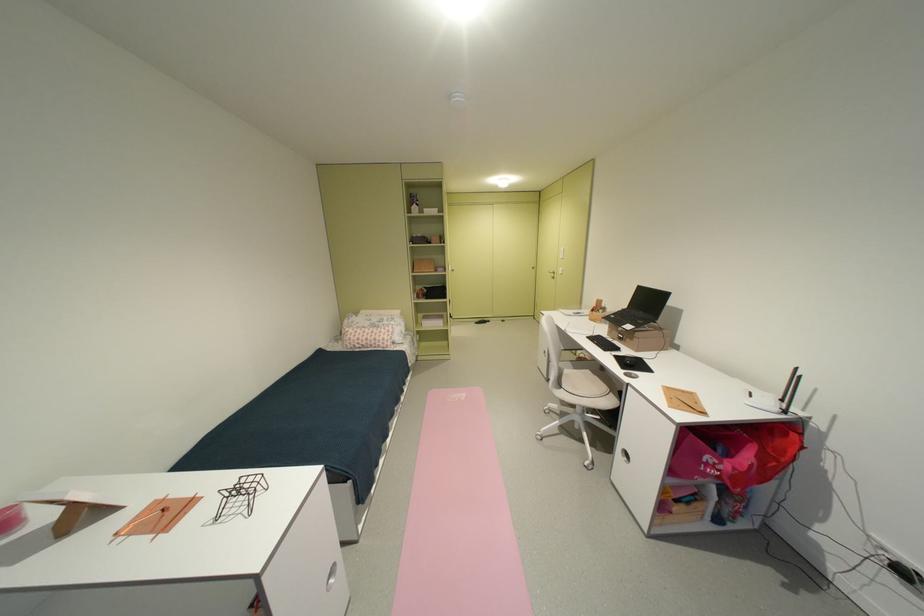
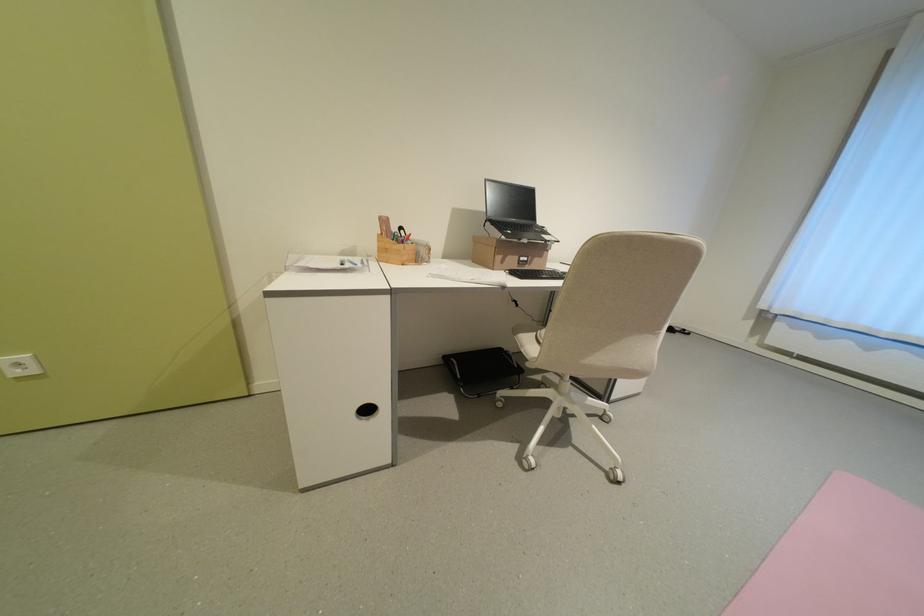
The point at (623, 318) is marked in the first image. Where is the corresponding point in the second image?

(518, 233)